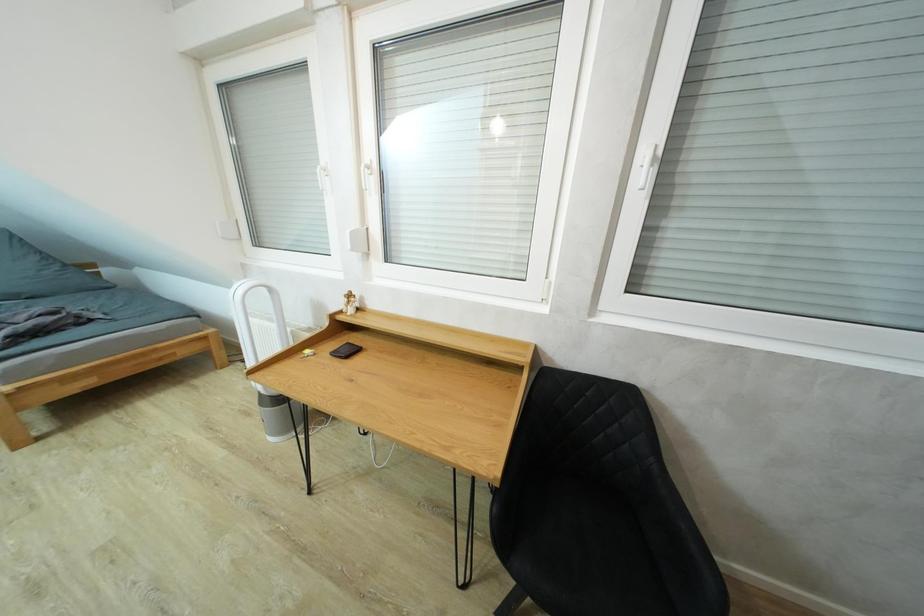
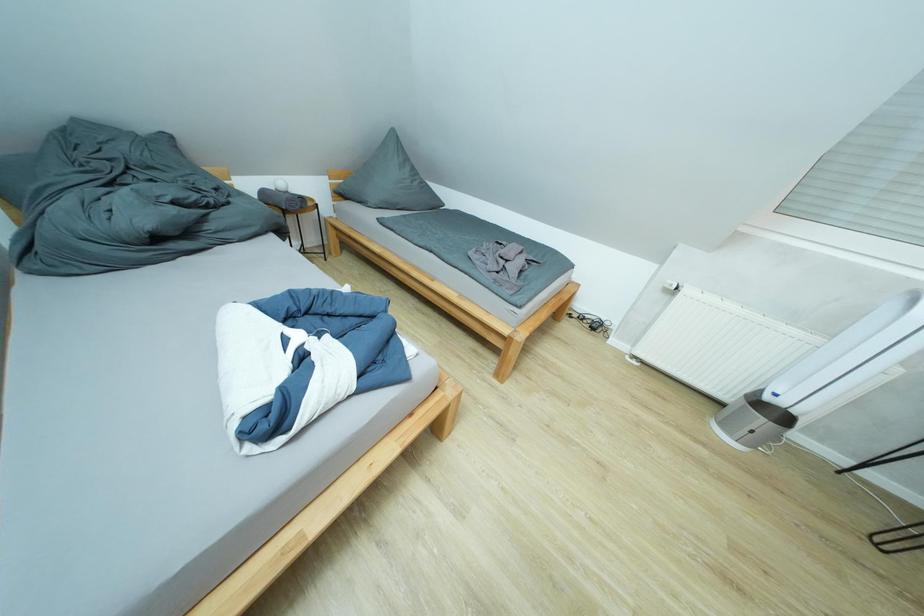
Question: Which direction would the cameraman need to move to produce the second image? Reply with the corresponding letter.

Choices:
 (A) Left
 (B) Right
 (C) Forward
 (D) Backward

Answer: (A)